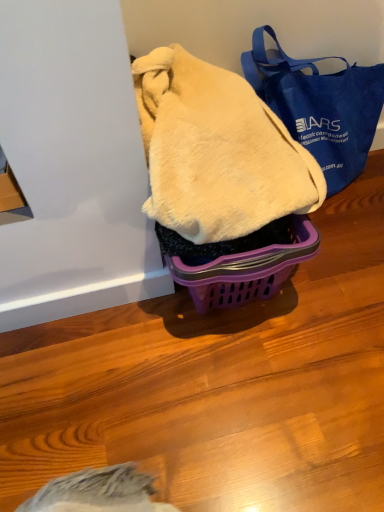
This screenshot has height=512, width=384. Describe the element at coordinates (320, 106) in the screenshot. I see `blue canvas tote bag at upper right` at that location.

Identify the location of blue canvas tote bag at upper right. (320, 106).

Locate an element on the screen. blue canvas tote bag at upper right is located at coordinates (320, 106).